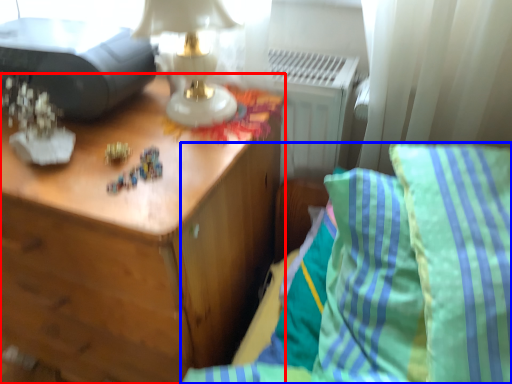
Question: Which object appears farthest to the camera in this image, nightstand (highlighted by a red box) or furniture (highlighted by a blue box)?

Choices:
 (A) nightstand
 (B) furniture

Answer: (A)